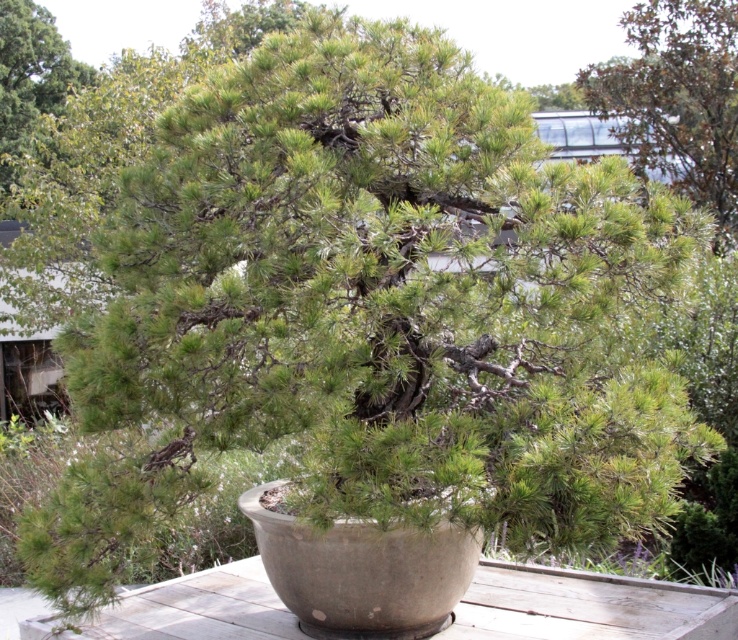
Does green needle-like at upper right have a lesser height compared to green matte tree at upper left?

No.

Who is more forward, (x=638, y=100) or (x=51, y=74)?

Point (x=638, y=100)

This screenshot has height=640, width=738. Identify the location of green needle-like at upper right. (677, 100).